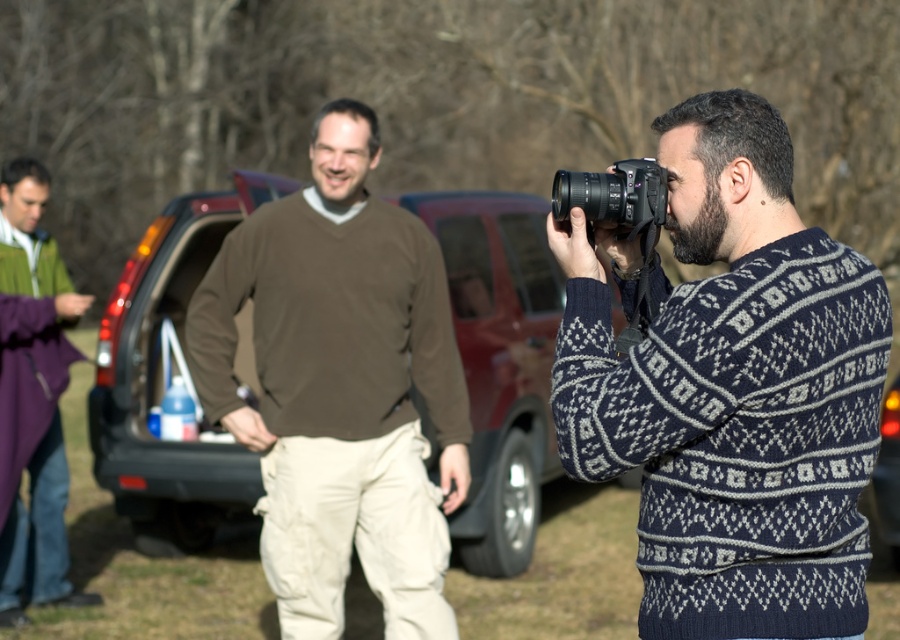
Does black plastic camera at center have a greater height compared to metallic silver car at center?

Incorrect, black plastic camera at center's height is not larger of metallic silver car at center's.

Is point (663, 209) less distant than point (897, 484)?

Yes, point (663, 209) is in front of point (897, 484).

I want to click on black plastic camera at center, so click(615, 198).

This screenshot has height=640, width=900. Find the location of `black plastic camera at center`. black plastic camera at center is located at coordinates (615, 198).

Does point (104, 390) come behind point (633, 228)?

Yes.

Can you confirm if matte brown car at center is positioned below black plastic camera at center?

Yes, matte brown car at center is below black plastic camera at center.

Does point (504, 248) come closer to viewer compared to point (573, 193)?

No.

Where is `matte brown car at center`? matte brown car at center is located at coordinates (500, 362).

Who is higher up, brown cotton sweater at center or matte brown car at center?

Positioned higher is matte brown car at center.

Who is positioned more to the right, brown cotton sweater at center or matte brown car at center?

From the viewer's perspective, matte brown car at center appears more on the right side.

At what (x,y) coordinates should I click in order to perform the action: click on brown cotton sweater at center. Please return your answer as a coordinate pair (x, y). The height and width of the screenshot is (640, 900). Looking at the image, I should click on click(x=342, y=387).